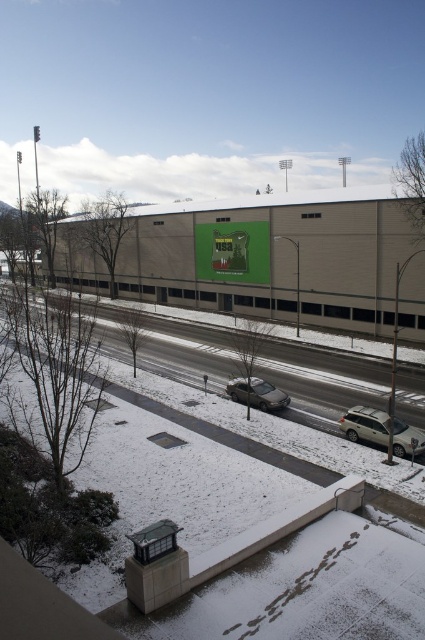
You are a delivery driver who needs to park your truck between the satin silver suv at lower right and the satin silver sedan at center. The truck requires 6 meters of space. Is there enough space between them?

The distance between the satin silver suv at lower right and the satin silver sedan at center is 5.09 meters. Since the truck requires 6 meters of space, there is not enough space between them.